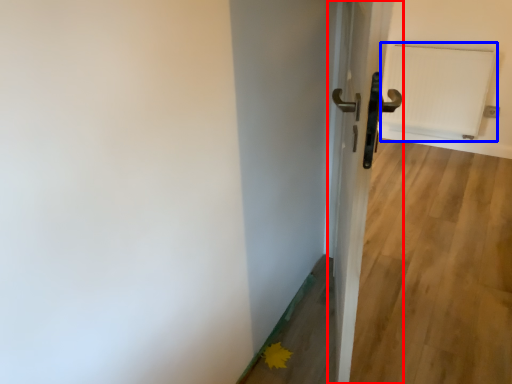
Question: Among these objects, which one is nearest to the camera, door (highlighted by a red box) or radiator (highlighted by a blue box)?

Choices:
 (A) door
 (B) radiator

Answer: (A)